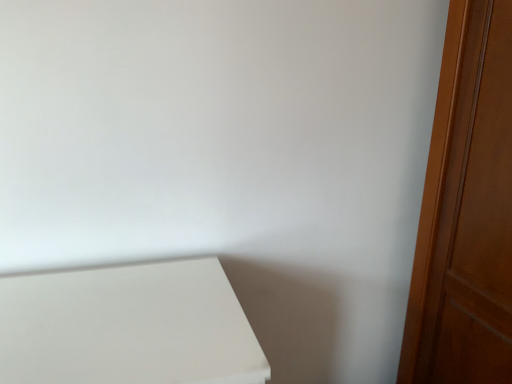
What is the approximate width of white matte table at lower left?

It is 20.86 inches.

The width and height of the screenshot is (512, 384). What do you see at coordinates (127, 327) in the screenshot?
I see `white matte table at lower left` at bounding box center [127, 327].

Locate an element on the screen. The width and height of the screenshot is (512, 384). white matte table at lower left is located at coordinates (127, 327).

At what (x,y) coordinates should I click in order to perform the action: click on white matte table at lower left. Please return your answer as a coordinate pair (x, y). This screenshot has width=512, height=384. Looking at the image, I should click on (127, 327).